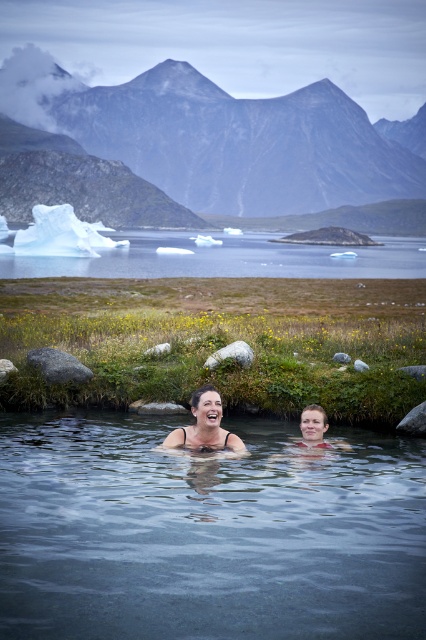
Looking at this image, can you confirm if white icebergs at upper left is smaller than smooth skin woman at center?

Actually, white icebergs at upper left might be larger than smooth skin woman at center.

Between white icebergs at upper left and smooth skin woman at center, which one appears on the right side from the viewer's perspective?

From the viewer's perspective, white icebergs at upper left appears more on the right side.

Is point (203, 252) farther from viewer compared to point (189, 426)?

Yes.

In order to click on white icebergs at upper left in this screenshot , I will do `click(226, 259)`.

Is point (215, 273) behind point (298, 442)?

Yes, point (215, 273) is behind point (298, 442).

Does white icebergs at upper left appear under smooth skin couple at center?

No, white icebergs at upper left is not below smooth skin couple at center.

This screenshot has width=426, height=640. Identify the location of white icebergs at upper left. (226, 259).

Identify the location of white icebergs at upper left. Image resolution: width=426 pixels, height=640 pixels. (226, 259).

Does point (305, 426) come behind point (236, 444)?

Yes, point (305, 426) is farther from viewer.

Can you confirm if smooth skin couple at center is positioned above smooth skin woman at center?

Yes.

Image resolution: width=426 pixels, height=640 pixels. Describe the element at coordinates (204, 426) in the screenshot. I see `smooth skin couple at center` at that location.

The height and width of the screenshot is (640, 426). I want to click on smooth skin couple at center, so click(x=204, y=426).